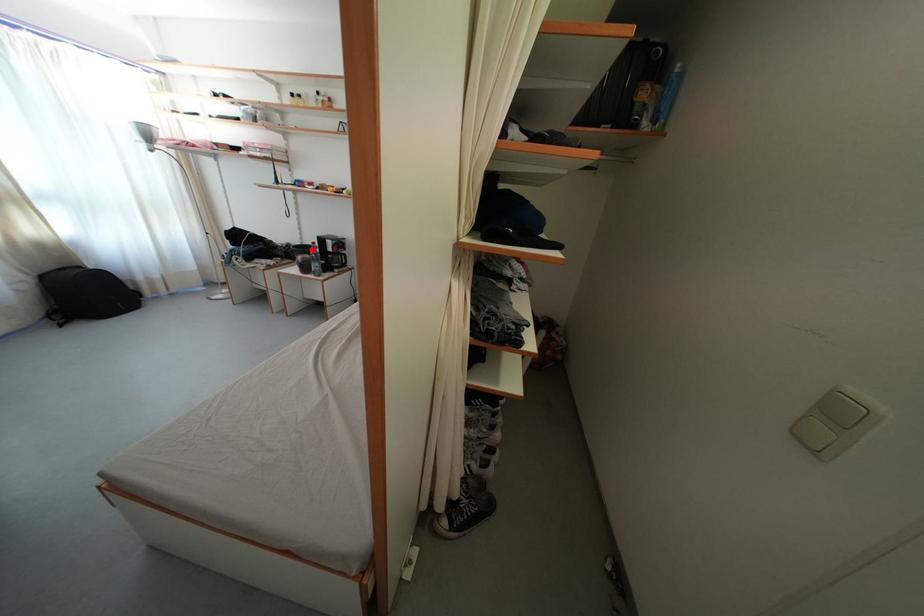
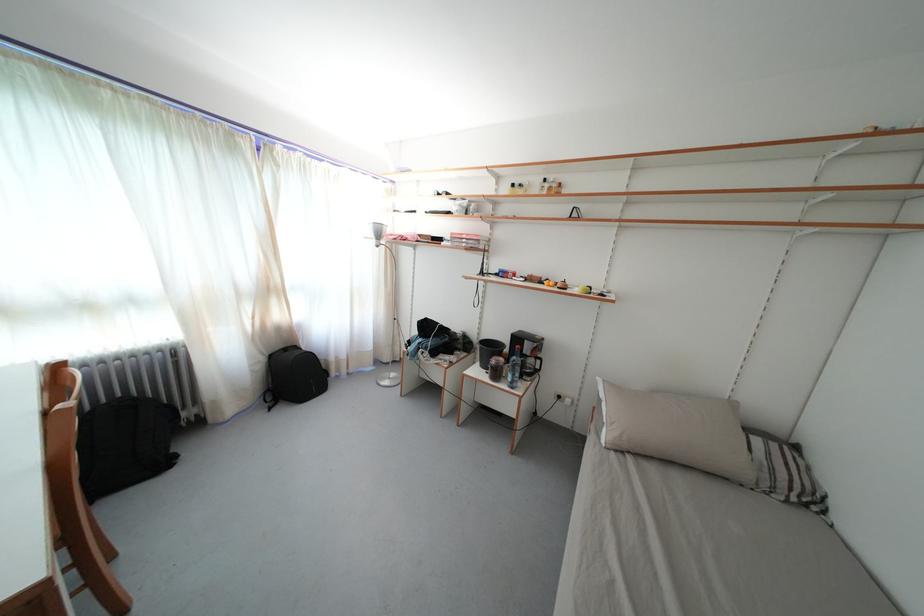
Find the pixel in the second image that matches the highlighted location in the first image.

(491, 341)